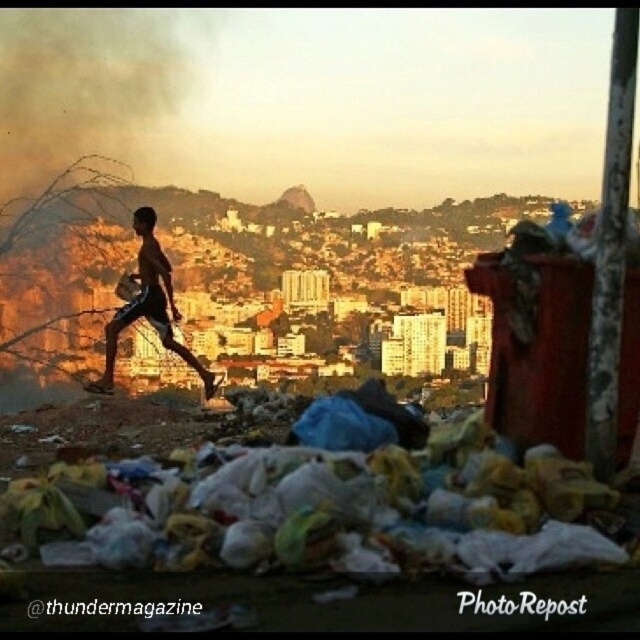
You are a city planner analyzing the urban scene. You see the point at coordinates (x=76, y=99). What environmental hazard is located at that point?

The point at coordinates (x=76, y=99) corresponds to black smoke at upper left, which is an environmental hazard.

You are a city planner analyzing this image. You need to determine which object occupies more space in the scene between the plastic bags at lower center and the black smoke at upper left. Based on the scene description, which one is larger?

The plastic bags at lower center has a larger size compared to the black smoke at upper left, so the plastic bags at lower center occupies more space in the scene.

You are a city planner analyzing the image. You need to determine if the plastic bags at lower center can be placed into the shiny metallic shorts at left. Based on the spatial information provided, can they fit?

The plastic bags at lower center are wider than the shiny metallic shorts at left, so they cannot fit into the shiny metallic shorts at left.